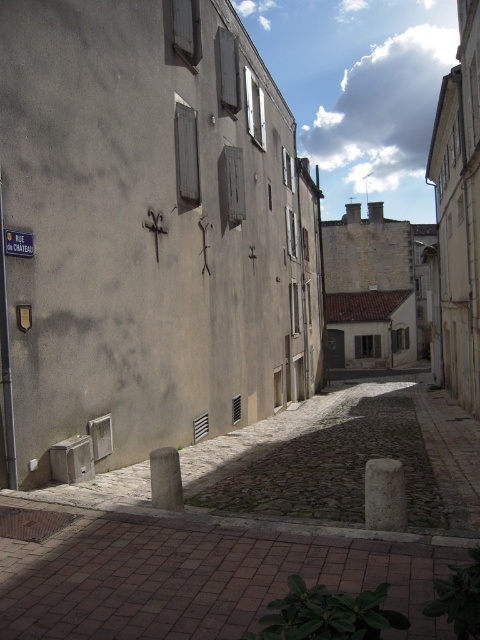
Measure the distance from wooden textured shutter at center to white painted wood shutter at upper center.

They are 6.22 meters apart.

Consider the image. Can you confirm if wooden textured shutter at center is positioned to the right of white painted wood shutter at upper center?

Incorrect, wooden textured shutter at center is not on the right side of white painted wood shutter at upper center.

Find the location of `wooden textured shutter at center`. wooden textured shutter at center is located at coordinates (187, 156).

Which is below, brick pavement at lower center or wooden shutter at upper center?

brick pavement at lower center

Who is higher up, brick pavement at lower center or wooden shutter at upper center?

wooden shutter at upper center is higher up.

Does point (417, 561) come closer to viewer compared to point (238, 67)?

Yes, point (417, 561) is closer to viewer.

Where is `brick pavement at lower center`? brick pavement at lower center is located at coordinates (194, 577).

Is brick pavement at lower center bigger than wooden shutter at center?

Yes.

Identify the location of brick pavement at lower center. This screenshot has height=640, width=480. (194, 577).